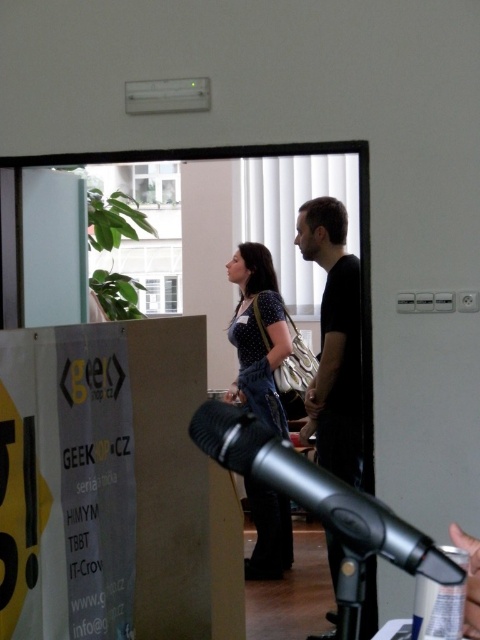
Which is behind, point (362, 545) or point (257, 332)?

Positioned behind is point (257, 332).

Who is higher up, silver metallic microphone at center or polka dot blouse at center?

Positioned higher is polka dot blouse at center.

Locate an element on the screen. The image size is (480, 640). silver metallic microphone at center is located at coordinates (317, 492).

Is silver metallic microphone at center to the left of black matte shirt at center from the viewer's perspective?

Correct, you'll find silver metallic microphone at center to the left of black matte shirt at center.

Is point (423, 570) in front of point (352, 308)?

Yes.

Between point (396, 550) and point (320, 452), which one is positioned behind?

Point (320, 452)

Locate an element on the screen. Image resolution: width=480 pixels, height=640 pixels. silver metallic microphone at center is located at coordinates (317, 492).

Is black matte shirt at center smaller than polka dot blouse at center?

Actually, black matte shirt at center might be larger than polka dot blouse at center.

Between black matte shirt at center and polka dot blouse at center, which one appears on the right side from the viewer's perspective?

black matte shirt at center

The image size is (480, 640). Describe the element at coordinates (335, 340) in the screenshot. I see `black matte shirt at center` at that location.

Image resolution: width=480 pixels, height=640 pixels. Find the location of `black matte shirt at center`. black matte shirt at center is located at coordinates (335, 340).